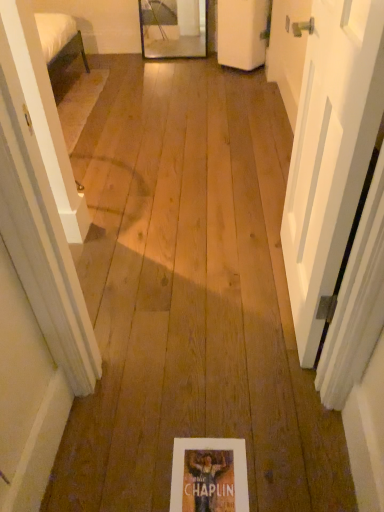
Question: From the image's perspective, is matte paper flyer at center on white matte door at upper center, the second door ordered from the bottom?

Choices:
 (A) no
 (B) yes

Answer: (A)

Question: From the image's perspective, does matte paper flyer at center appear lower than white matte door at upper center, the second door in the front-to-back sequence?

Choices:
 (A) no
 (B) yes

Answer: (B)

Question: Does matte paper flyer at center have a greater width compared to white matte door at upper center, the second door in the front-to-back sequence?

Choices:
 (A) no
 (B) yes

Answer: (A)

Question: Does matte paper flyer at center lie in front of white matte door at upper center, the second door in the front-to-back sequence?

Choices:
 (A) no
 (B) yes

Answer: (B)

Question: Is matte paper flyer at center bigger than white matte door at upper center, acting as the 1th door starting from the top?

Choices:
 (A) no
 (B) yes

Answer: (A)

Question: Is matte paper flyer at center surrounding white matte door at upper center, which is counted as the 1th door, starting from the back?

Choices:
 (A) no
 (B) yes

Answer: (A)

Question: Is white matte door at upper center, the second door in the front-to-back sequence, facing away from matte paper flyer at center?

Choices:
 (A) no
 (B) yes

Answer: (A)

Question: Considering the relative positions of white matte door at upper center, the second door ordered from the bottom, and matte paper flyer at center in the image provided, is white matte door at upper center, the second door ordered from the bottom, to the left of matte paper flyer at center from the viewer's perspective?

Choices:
 (A) yes
 (B) no

Answer: (B)

Question: Is white matte door at upper center, acting as the 1th door starting from the top, not close to matte paper flyer at center?

Choices:
 (A) yes
 (B) no

Answer: (A)

Question: Does white matte door at upper center, the second door in the front-to-back sequence, contain matte paper flyer at center?

Choices:
 (A) yes
 (B) no

Answer: (B)

Question: Considering the relative sizes of white matte door at upper center, which is counted as the 1th door, starting from the back, and matte paper flyer at center in the image provided, is white matte door at upper center, which is counted as the 1th door, starting from the back, smaller than matte paper flyer at center?

Choices:
 (A) no
 (B) yes

Answer: (A)

Question: From a real-world perspective, is white matte door at upper center, the second door in the front-to-back sequence, over matte paper flyer at center?

Choices:
 (A) yes
 (B) no

Answer: (A)

Question: Is white matte door at right, acting as the second door starting from the back, placed right next to matte paper flyer at center?

Choices:
 (A) no
 (B) yes

Answer: (A)